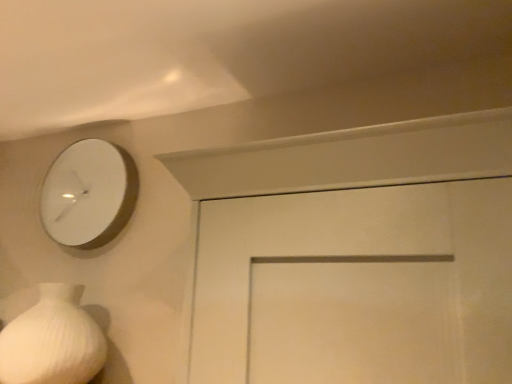
Question: Is white ribbed vase at lower left oriented away from white matte clock at upper left?

Choices:
 (A) no
 (B) yes

Answer: (A)

Question: Is white ribbed vase at lower left located outside white matte clock at upper left?

Choices:
 (A) no
 (B) yes

Answer: (B)

Question: Can you confirm if white ribbed vase at lower left is positioned to the left of white matte clock at upper left?

Choices:
 (A) yes
 (B) no

Answer: (A)

Question: Is white ribbed vase at lower left smaller than white matte clock at upper left?

Choices:
 (A) no
 (B) yes

Answer: (A)

Question: From the image's perspective, is white ribbed vase at lower left on white matte clock at upper left?

Choices:
 (A) yes
 (B) no

Answer: (B)

Question: Can you confirm if white ribbed vase at lower left is thinner than white matte clock at upper left?

Choices:
 (A) no
 (B) yes

Answer: (A)

Question: Does white matte clock at upper left have a smaller size compared to white ribbed vase at lower left?

Choices:
 (A) yes
 (B) no

Answer: (A)

Question: Does white matte clock at upper left appear on the left side of white ribbed vase at lower left?

Choices:
 (A) yes
 (B) no

Answer: (B)

Question: From the image's perspective, does white matte clock at upper left appear higher than white ribbed vase at lower left?

Choices:
 (A) no
 (B) yes

Answer: (B)

Question: Is white matte clock at upper left wider than white ribbed vase at lower left?

Choices:
 (A) no
 (B) yes

Answer: (A)

Question: Can you confirm if white matte clock at upper left is thinner than white ribbed vase at lower left?

Choices:
 (A) no
 (B) yes

Answer: (B)

Question: From a real-world perspective, is white matte clock at upper left on top of white ribbed vase at lower left?

Choices:
 (A) yes
 (B) no

Answer: (A)

Question: In the image, is white ribbed vase at lower left positioned in front of or behind white matte clock at upper left?

Choices:
 (A) front
 (B) behind

Answer: (A)